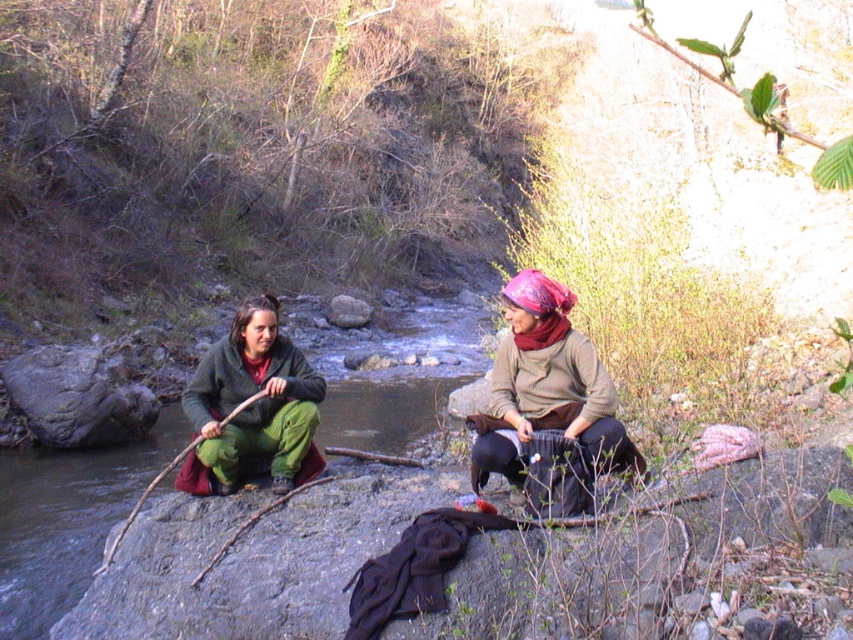
Is matte brown scarf at center positioned in front of green fuzzy pants at left?

That is True.

Between matte brown scarf at center and green fuzzy pants at left, which one appears on the right side from the viewer's perspective?

Positioned to the right is matte brown scarf at center.

The width and height of the screenshot is (853, 640). What do you see at coordinates (546, 388) in the screenshot?
I see `matte brown scarf at center` at bounding box center [546, 388].

In order to click on matte brown scarf at center in this screenshot , I will do click(546, 388).